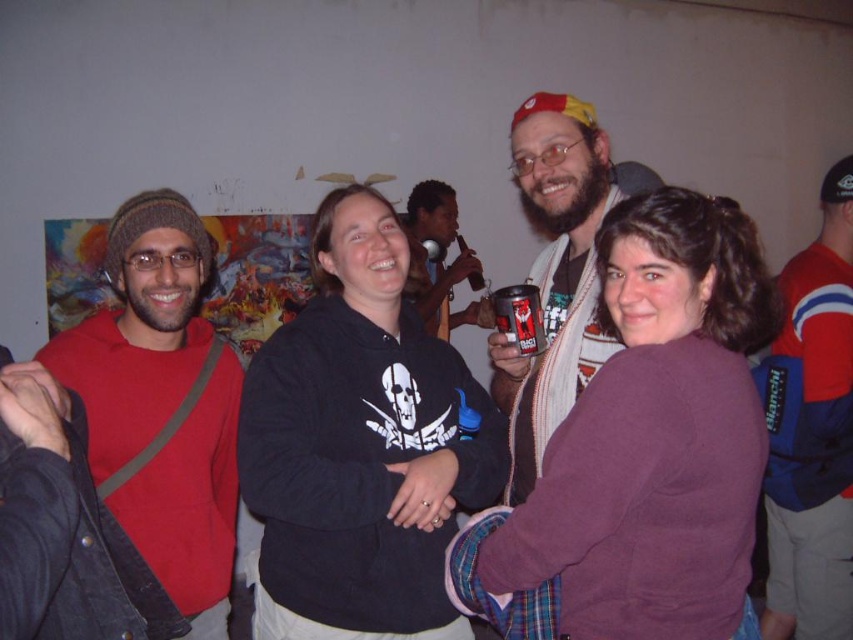
You are at a party and need to place a small note on either the red and blue jacket at right or the metallic can at center. Which object allows the note to be seen from a distance without needing to move it?

The red and blue jacket at right is taller than the metallic can at center, so placing the note on the red and blue jacket at right would make it more visible from a distance.

You are taking a photo of the scene and want to focus on both point (117, 234) and point (509, 484). Which point is closer to your camera lens?

Point (117, 234) is closer to the camera lens than point (509, 484).

You are at a party and want to grab the metallic can at center without touching the red and blue jacket at right. Is this possible?

The red and blue jacket at right is further to the viewer than metallic can at center, so the metallic can at center is behind the jacket. Therefore, you can reach the metallic can at center without moving the jacket.